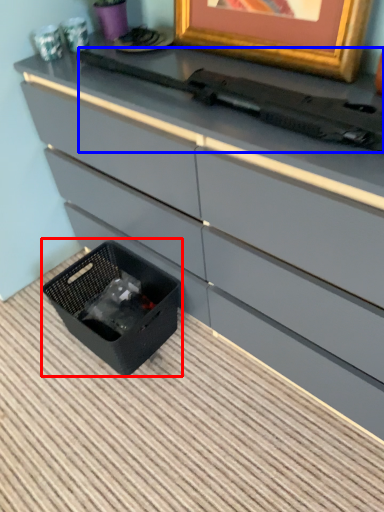
Question: Which object is further to the camera taking this photo, storage box (highlighted by a red box) or typewriter (highlighted by a blue box)?

Choices:
 (A) storage box
 (B) typewriter

Answer: (A)